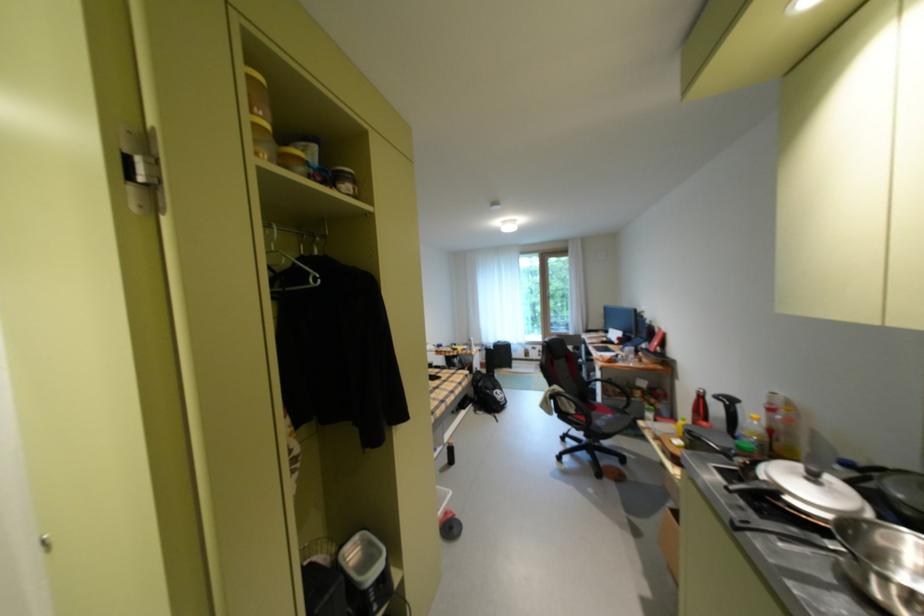
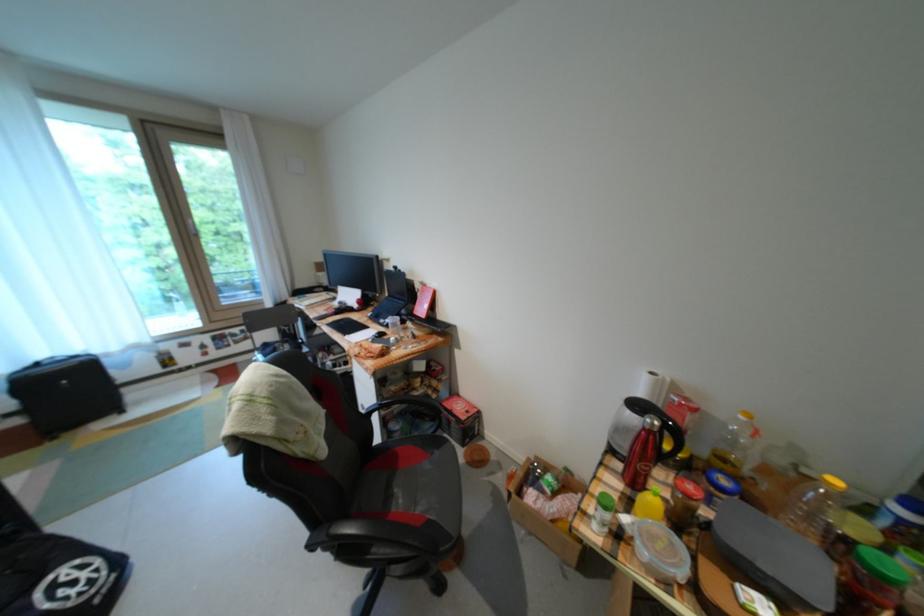
Where in the second image is the point corresponding to point (629, 416) from the first image?

(446, 455)